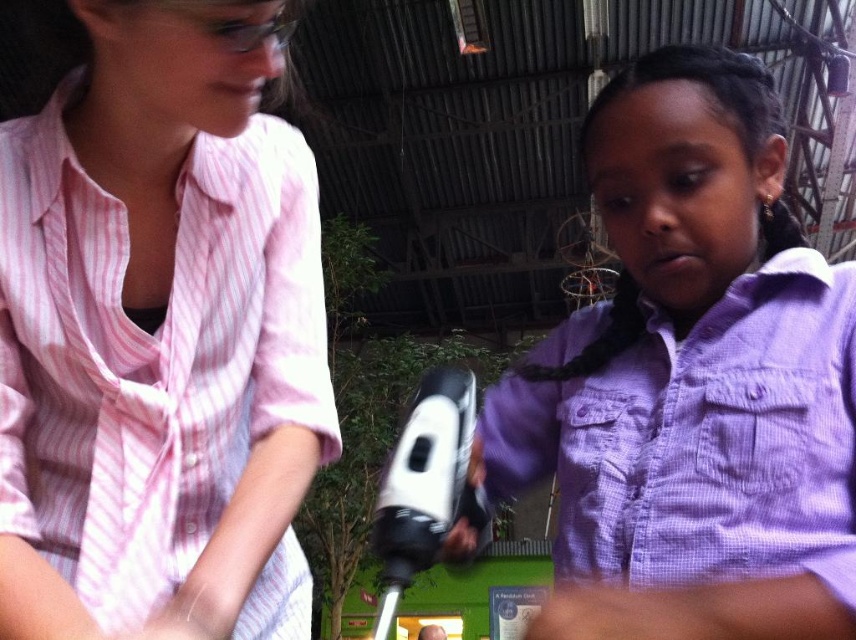
You are a photographer taking a portrait of the two people in the scene. You want to ensure the purple checkered shirt at center and the purple silky hair at center are both in focus. Which object should you focus on first to ensure both are sharp?

You should focus on the purple checkered shirt at center first because it is closer to the viewer than the purple silky hair at center. By focusing on the closer object, the depth of field will extend to include the farther object, ensuring both are in focus.

You are standing in the workshop and need to locate the person wearing the pink striped shirt at upper left. According to the coordinates provided, where should you look?

The pink striped shirt at upper left is located at coordinates point (159, 336).